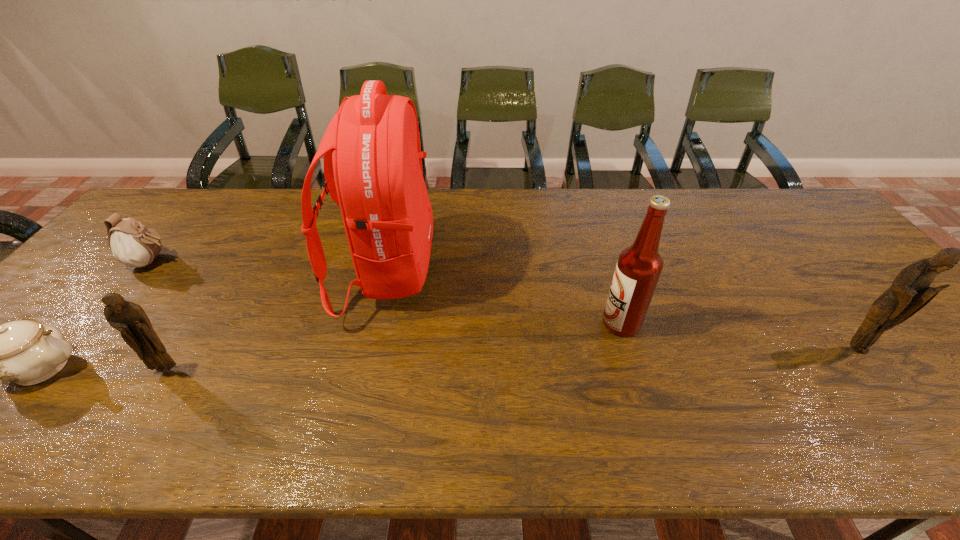
Where is `free space located 0.060m on the main compartment of the tallest object`? The height and width of the screenshot is (540, 960). free space located 0.060m on the main compartment of the tallest object is located at coordinates (455, 272).

The image size is (960, 540). What are the coordinates of `free space located on the front-facing side of the pouch` in the screenshot? It's located at (290, 262).

The width and height of the screenshot is (960, 540). In order to click on free space located on the label side of the second object from right to left in this screenshot , I will do tap(482, 323).

The width and height of the screenshot is (960, 540). I want to click on free point located 0.390m on the label side of the second object from right to left, so click(446, 323).

Locate an element on the screen. vacant area located on the label side of the second object from right to left is located at coordinates (526, 323).

This screenshot has width=960, height=540. I want to click on object located in the far edge section of the desktop, so click(x=373, y=171).

The image size is (960, 540). Identify the location of object that is at the near edge. coord(130,319).

At what (x,y) coordinates should I click in order to perform the action: click on object that is at the left edge. Please return your answer as a coordinate pair (x, y). Looking at the image, I should click on (133, 244).

This screenshot has height=540, width=960. In order to click on free region at the far edge of the desktop in this screenshot , I will do `click(251, 228)`.

The height and width of the screenshot is (540, 960). In the image, there is a desktop. What are the coordinates of `free space at the near edge` in the screenshot? It's located at (106, 390).